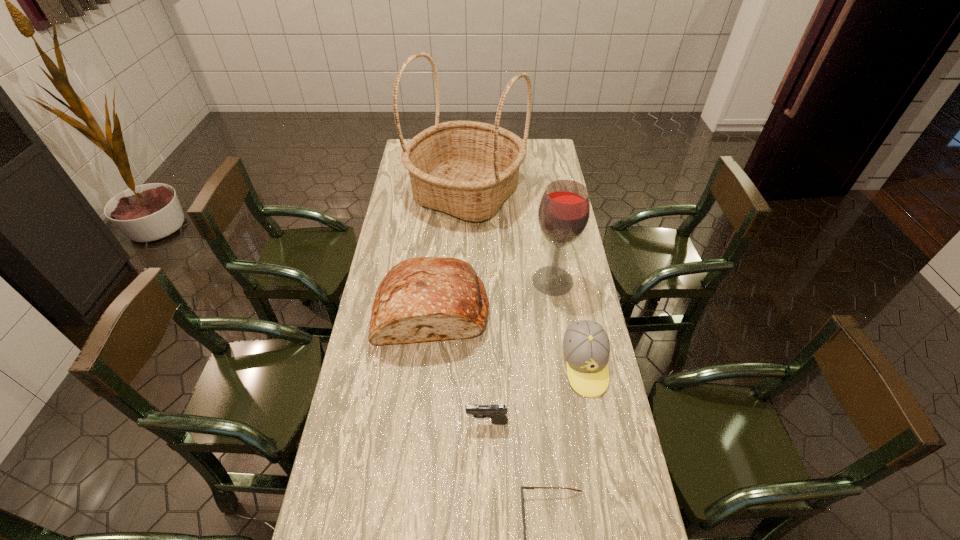
Locate an element on the screen. This screenshot has width=960, height=540. free region located on the front-facing side of the fourth tallest object is located at coordinates (608, 484).

The image size is (960, 540). Identify the location of vacant space located 0.200m at the barrel of the pistol. (397, 422).

The width and height of the screenshot is (960, 540). Find the location of `free space located 0.290m at the barrel of the pistol`. free space located 0.290m at the barrel of the pistol is located at coordinates (367, 422).

Locate an element on the screen. The height and width of the screenshot is (540, 960). vacant space situated at the barrel of the pistol is located at coordinates [376, 422].

What are the coordinates of `object present at the far edge` in the screenshot? It's located at (467, 169).

Locate an element on the screen. basket located at the left edge is located at coordinates (467, 169).

Where is `bread present at the left edge`? Image resolution: width=960 pixels, height=540 pixels. bread present at the left edge is located at coordinates (421, 299).

The width and height of the screenshot is (960, 540). I want to click on alcohol at the right edge, so click(x=564, y=210).

Identify the location of baseball cap present at the right edge. The height and width of the screenshot is (540, 960). (586, 347).

At what (x,y) coordinates should I click in order to perform the action: click on object located in the far left corner section of the desktop. Please return your answer as a coordinate pair (x, y). Image resolution: width=960 pixels, height=540 pixels. Looking at the image, I should click on (467, 169).